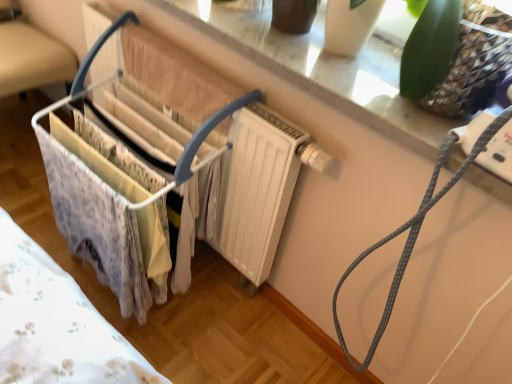
In order to click on free space above white glossy window sill at upper center (from a real-world perspective) in this screenshot , I will do [x=340, y=60].